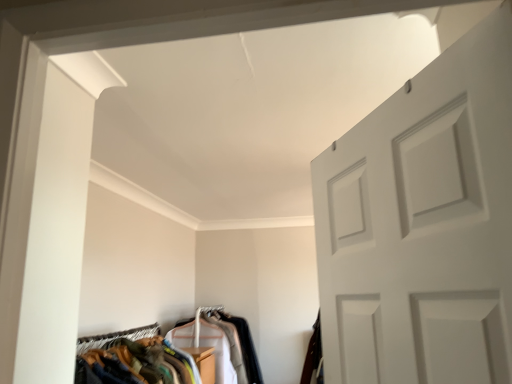
Image resolution: width=512 pixels, height=384 pixels. What do you see at coordinates (230, 348) in the screenshot?
I see `white cotton shirt at lower left` at bounding box center [230, 348].

What is the approximate height of white cotton shirt at lower left?

white cotton shirt at lower left is 22.30 inches in height.

The height and width of the screenshot is (384, 512). I want to click on white cotton shirt at lower left, so click(x=230, y=348).

Identify the location of white cotton shirt at lower left. (230, 348).